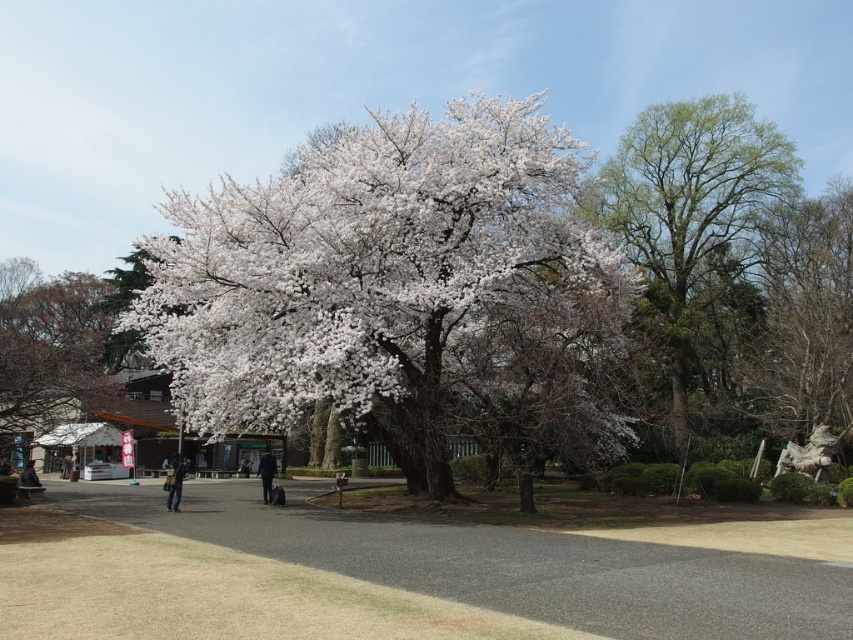
Looking at this image, you are standing in the serene outdoor scene with the large tree in full bloom. You notice a point marked at coordinates (364, 266). What object is located at this point?

The point at coordinates (364, 266) indicates the white matte flower at center.

You are an artist planning to paint the scene. You want to ensure the white matte flower at center and the white blossoming tree at left are proportionally accurate. Which object should you paint larger in your artwork?

The white matte flower at center should be painted larger because its width is larger than the white blossoming tree at left according to the description.

In the scene shown: You are standing in the outdoor scene and want to pick up the denim jacket at lower left. Which direction should you move relative to the white matte flower at center?

You should move to the right relative to the white matte flower at center because the denim jacket at lower left is to the right of it.